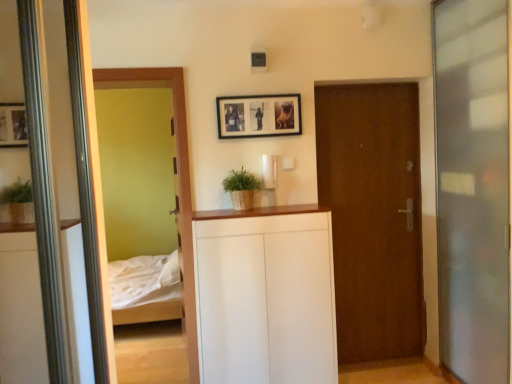
Find the location of `black matte picture frame at upper center`. black matte picture frame at upper center is located at coordinates (259, 116).

What do you see at coordinates (373, 216) in the screenshot? This screenshot has height=384, width=512. I see `brown wooden door at center` at bounding box center [373, 216].

Where is `white matte cabinet at center`? This screenshot has width=512, height=384. white matte cabinet at center is located at coordinates (266, 296).

The width and height of the screenshot is (512, 384). Identify the location of black matte picture frame at upper center. (259, 116).

Is white matte cabinet at center surrounding braided straw plant at center?

No, braided straw plant at center is not a part of white matte cabinet at center.

Is point (242, 223) farther from camera compared to point (237, 181)?

No, (242, 223) is closer to viewer.

Who is shorter, white matte cabinet at center or braided straw plant at center?

braided straw plant at center is shorter.

Which object is more forward, white matte cabinet at center or braided straw plant at center?

white matte cabinet at center is more forward.

Can you see brown wooden door at center touching braided straw plant at center?

brown wooden door at center and braided straw plant at center are not in contact.

From a real-world perspective, is brown wooden door at center positioned over braided straw plant at center based on gravity?

Actually, brown wooden door at center is physically below braided straw plant at center in the real world.

From the image's perspective, is brown wooden door at center located beneath braided straw plant at center?

Yes.

Could you tell me if brown wooden door at center is facing braided straw plant at center?

No.

Does brown wooden door at center have a greater height compared to white matte cabinet at center?

Correct, brown wooden door at center is much taller as white matte cabinet at center.

Is brown wooden door at center positioned far away from white matte cabinet at center?

No.

Can you tell me how much brown wooden door at center and white matte cabinet at center differ in facing direction?

They differ by 0.716 degrees in their facing directions.

Based on their positions, is brown wooden door at center located to the left or right of white matte cabinet at center?

From the image, it's evident that brown wooden door at center is to the right of white matte cabinet at center.

Which is more to the right, transparent glass screen door at right or brown wooden door at center?

transparent glass screen door at right.

Can you confirm if transparent glass screen door at right is taller than brown wooden door at center?

Yes.

From the image's perspective, between transparent glass screen door at right and brown wooden door at center, which one is located above?

transparent glass screen door at right is shown above in the image.

Is transparent glass screen door at right further to the viewer compared to brown wooden door at center?

No, transparent glass screen door at right is closer to the viewer.

How different are the orientations of transparent glass screen door at right and braided straw plant at center in degrees?

90.8 degrees.

Is braided straw plant at center at the back of transparent glass screen door at right?

No, transparent glass screen door at right's orientation is not away from braided straw plant at center.

Does transparent glass screen door at right appear on the left side of braided straw plant at center?

No, transparent glass screen door at right is not to the left of braided straw plant at center.

At what (x,y) coordinates should I click in order to perform the action: click on door behind the transparent glass screen door at right. Please return your answer as a coordinate pair (x, y). The image size is (512, 384). Looking at the image, I should click on (373, 216).

How many degrees apart are the facing directions of brown wooden door at center and transparent glass screen door at right?

90.1 degrees separate the facing orientations of brown wooden door at center and transparent glass screen door at right.

Is brown wooden door at center positioned before transparent glass screen door at right?

That is False.

Is brown wooden door at center oriented towards transparent glass screen door at right?

Yes, brown wooden door at center is aimed at transparent glass screen door at right.

Looking at this image, which point is more forward, (227, 191) or (278, 100)?

Point (278, 100)

From a real-world perspective, which object rests below the other?

braided straw plant at center, from a real-world perspective.

From the image's perspective, which is below, braided straw plant at center or black matte picture frame at upper center?

braided straw plant at center.

Is braided straw plant at center at the left side of black matte picture frame at upper center?

Yes, braided straw plant at center is to the left of black matte picture frame at upper center.

You are a GUI agent. You are given a task and a screenshot of the screen. Output one action in this format:
    pyautogui.click(x=<x>, y=<y>)
    Task: Click on the houseplant that is above the white matte cabinet at center (from a real-world perspective)
    
    Given the screenshot: What is the action you would take?
    pyautogui.click(x=241, y=188)

You are a GUI agent. You are given a task and a screenshot of the screen. Output one action in this format:
    pyautogui.click(x=<x>, y=<y>)
    Task: Click on the houseplant that appears above the brown wooden door at center (from the image's perspective)
    
    Given the screenshot: What is the action you would take?
    pyautogui.click(x=241, y=188)

Estimate the real-world distances between objects in this image. Which object is further from braided straw plant at center, black matte picture frame at upper center or transparent glass screen door at right?

Among the two, transparent glass screen door at right is located further to braided straw plant at center.

Estimate the real-world distances between objects in this image. Which object is closer to transparent glass screen door at right, brown wooden door at center or black matte picture frame at upper center?

brown wooden door at center is closer to transparent glass screen door at right.

From the picture: Looking at the image, which one is located closer to black matte picture frame at upper center, white matte cabinet at center or braided straw plant at center?

The object closer to black matte picture frame at upper center is braided straw plant at center.

Based on their spatial positions, is braided straw plant at center or black matte picture frame at upper center closer to transparent glass screen door at right?

black matte picture frame at upper center lies closer to transparent glass screen door at right than the other object.

When comparing their distances from black matte picture frame at upper center, does transparent glass screen door at right or white matte cabinet at center seem further?

Among the two, transparent glass screen door at right is located further to black matte picture frame at upper center.

Estimate the real-world distances between objects in this image. Which object is closer to brown wooden door at center, white matte cabinet at center or transparent glass screen door at right?

Based on the image, transparent glass screen door at right appears to be nearer to brown wooden door at center.

Which object lies nearer to the anchor point braided straw plant at center, brown wooden door at center or transparent glass screen door at right?

brown wooden door at center.

Which object lies nearer to the anchor point white matte cabinet at center, black matte picture frame at upper center or transparent glass screen door at right?

The object closer to white matte cabinet at center is black matte picture frame at upper center.

Identify the location of door between black matte picture frame at upper center and white matte cabinet at center in the up-down direction. The width and height of the screenshot is (512, 384). (373, 216).

Find the location of a particular element. This screenshot has width=512, height=384. dresser situated between black matte picture frame at upper center and transparent glass screen door at right from left to right is located at coordinates (266, 296).

Identify the location of picture frame between braided straw plant at center and transparent glass screen door at right. point(259,116).

Find the location of `door between braided straw plant at center and transparent glass screen door at right`. door between braided straw plant at center and transparent glass screen door at right is located at coordinates (373, 216).